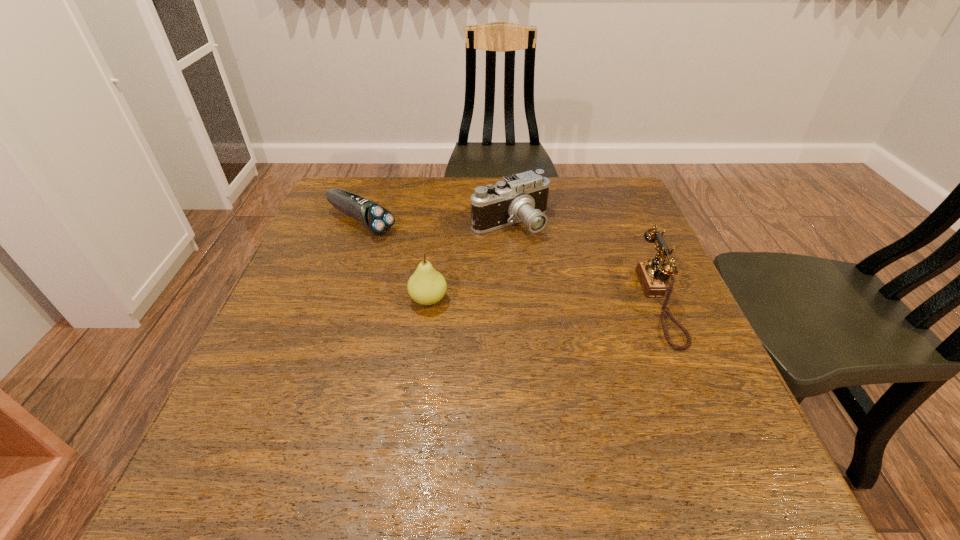
Find the location of `vacant area that lies between the camera and the shortest object`. vacant area that lies between the camera and the shortest object is located at coordinates (436, 223).

This screenshot has height=540, width=960. I want to click on vacant area that lies between the telephone and the electric shaver, so click(x=511, y=262).

The image size is (960, 540). What are the coordinates of `the closest object to the camera` in the screenshot? It's located at (426, 286).

Identify which object is the second closest to the second object from left to right. Please provide its 2D coordinates. Your answer should be formatted as a tuple, i.e. [(x, y)], where the tuple contains the x and y coordinates of a point satisfying the conditions above.

[(376, 219)]

Find the location of `free location that satisfies the following two spatial constraints: 1. on the front side of the third object from left to right; 2. on the front-facing side of the rightmost object`. free location that satisfies the following two spatial constraints: 1. on the front side of the third object from left to right; 2. on the front-facing side of the rightmost object is located at coordinates (516, 302).

Where is `free space that satisfies the following two spatial constraints: 1. on the front side of the third object from left to right; 2. on the front-facing side of the telephone`? The width and height of the screenshot is (960, 540). free space that satisfies the following two spatial constraints: 1. on the front side of the third object from left to right; 2. on the front-facing side of the telephone is located at coordinates (516, 302).

In order to click on vacant space that satisfies the following two spatial constraints: 1. on the front side of the leftmost object; 2. on the left side of the pear in this screenshot , I will do `click(334, 300)`.

Find the location of a particular element. free space that satisfies the following two spatial constraints: 1. on the front side of the rightmost object; 2. on the front-facing side of the shortest object is located at coordinates (333, 302).